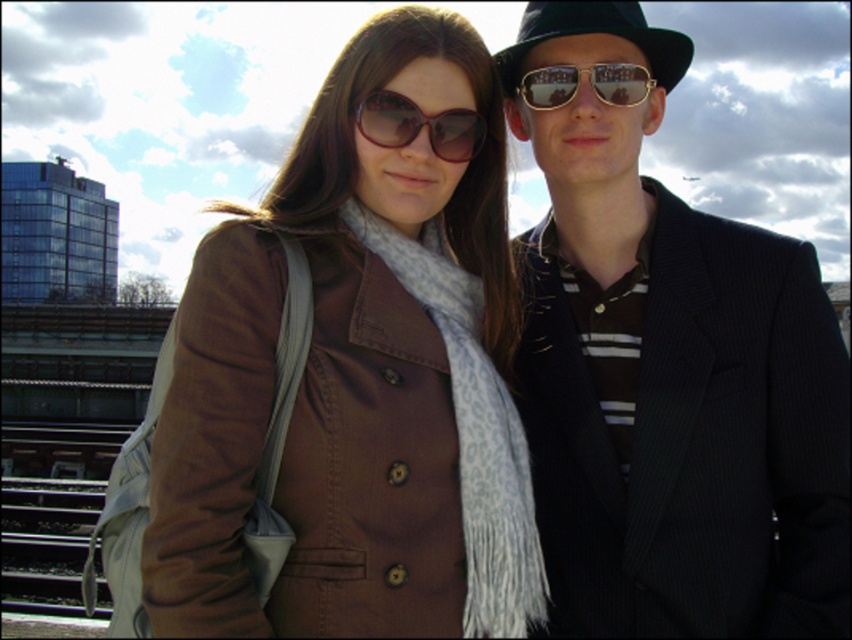
Question: Is black felt fedora at upper center below sunglasses at center?

Choices:
 (A) yes
 (B) no

Answer: (B)

Question: Is shiny black suit at center to the right of gold reflective sunglasses at center from the viewer's perspective?

Choices:
 (A) yes
 (B) no

Answer: (A)

Question: Which point is closer to the camera?

Choices:
 (A) black felt fedora at upper center
 (B) sunglasses at center

Answer: (B)

Question: Is black felt fedora at upper center positioned before gold reflective sunglasses at center?

Choices:
 (A) yes
 (B) no

Answer: (B)

Question: Which object is positioned farthest from the sunglasses at center?

Choices:
 (A) black felt fedora at upper center
 (B) gold reflective sunglasses at center
 (C) shiny black suit at center
 (D) brown fabric coat at center

Answer: (C)

Question: Estimate the real-world distances between objects in this image. Which object is farther from the gold reflective sunglasses at center?

Choices:
 (A) black felt fedora at upper center
 (B) sunglasses at center
 (C) shiny black suit at center
 (D) brown fabric coat at center

Answer: (C)